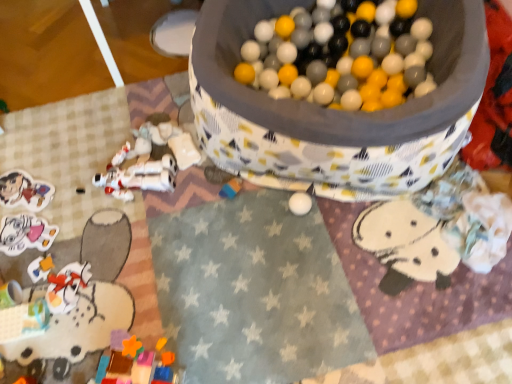
You are a GUI agent. You are given a task and a screenshot of the screen. Output one action in this format:
    pyautogui.click(x=<x>, y=<y>)
    Task: Click on the free space to the back side of matte white sticker at lower left, which appears as the 2th toy when viewed from the left
    This screenshot has height=384, width=512.
    Given the screenshot: What is the action you would take?
    pyautogui.click(x=42, y=192)